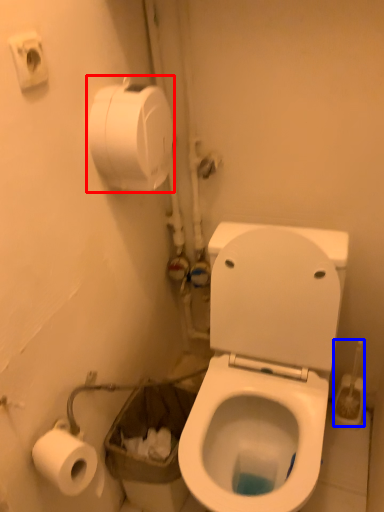
Question: Which object appears closest to the camera in this image, toilet paper (highlighted by a red box) or brush (highlighted by a blue box)?

Choices:
 (A) toilet paper
 (B) brush

Answer: (A)